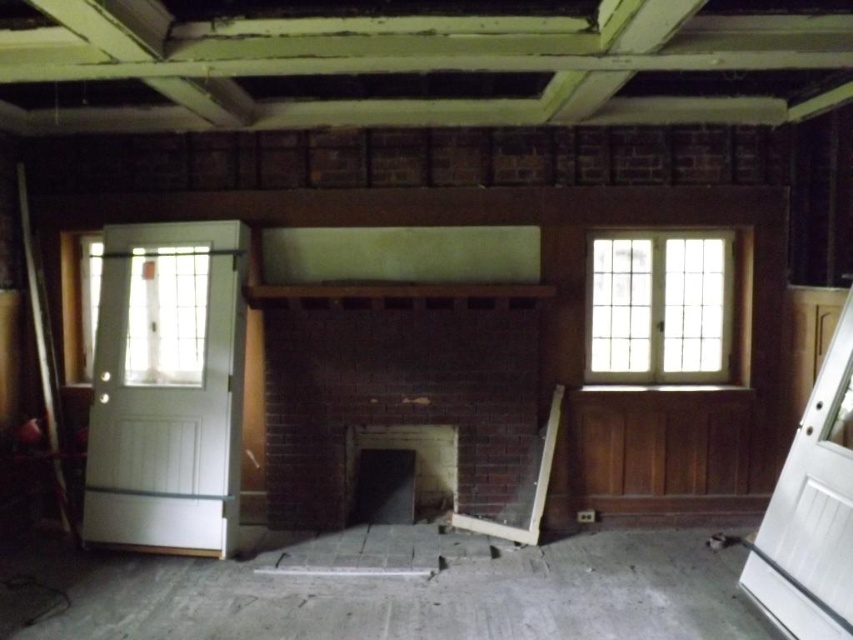
Can you confirm if brick fireplace at center is bigger than metallic silver ladder at left?

Indeed, brick fireplace at center has a larger size compared to metallic silver ladder at left.

Consider the image. Does brick fireplace at center have a lesser width compared to metallic silver ladder at left?

No.

Between point (482, 448) and point (62, 516), which one is positioned in front?

Point (62, 516) is more forward.

The width and height of the screenshot is (853, 640). Find the location of `brick fireplace at center`. brick fireplace at center is located at coordinates (398, 387).

Based on the photo, can you confirm if white wood door at left is positioned to the right of clear glass window at upper right?

In fact, white wood door at left is to the left of clear glass window at upper right.

Can you confirm if white wood door at left is bigger than clear glass window at upper right?

Correct, white wood door at left is larger in size than clear glass window at upper right.

Does point (202, 284) come closer to viewer compared to point (612, 326)?

Yes, point (202, 284) is in front of point (612, 326).

Locate an element on the screen. white wood door at left is located at coordinates (166, 387).

Based on the photo, does brick fireplace at center have a smaller size compared to white wood door at left?

Incorrect, brick fireplace at center is not smaller in size than white wood door at left.

Is brick fireplace at center taller than white wood door at left?

In fact, brick fireplace at center may be shorter than white wood door at left.

This screenshot has height=640, width=853. I want to click on brick fireplace at center, so click(x=398, y=387).